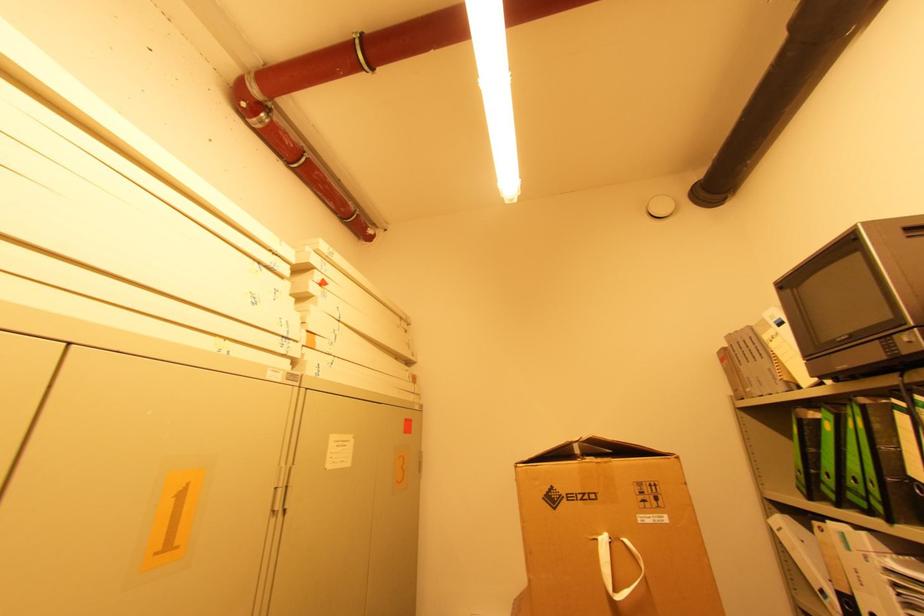
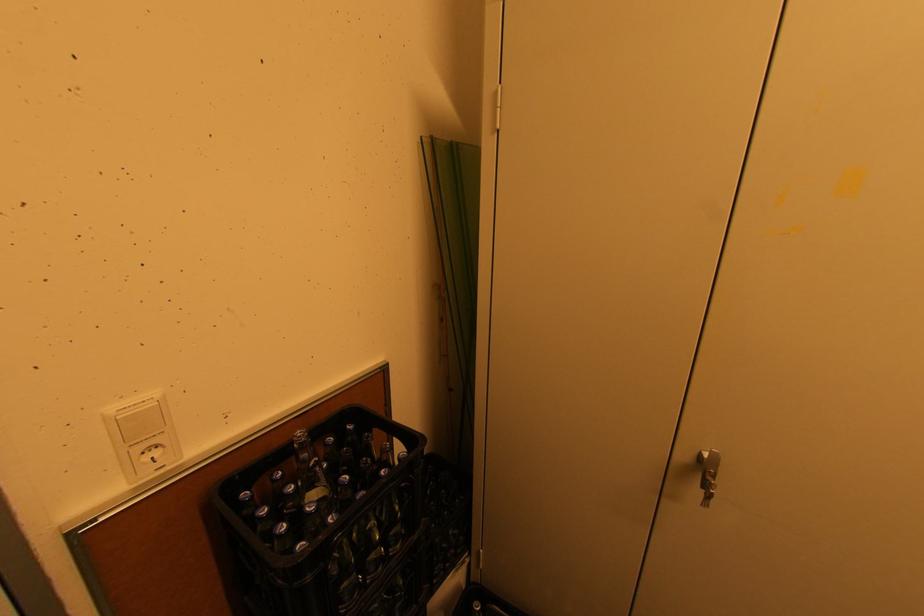
Question: Based on the continuous images, in which direction is the camera rotating? Reply with the corresponding letter.

Choices:
 (A) Left
 (B) Right
 (C) Up
 (D) Down

Answer: (A)